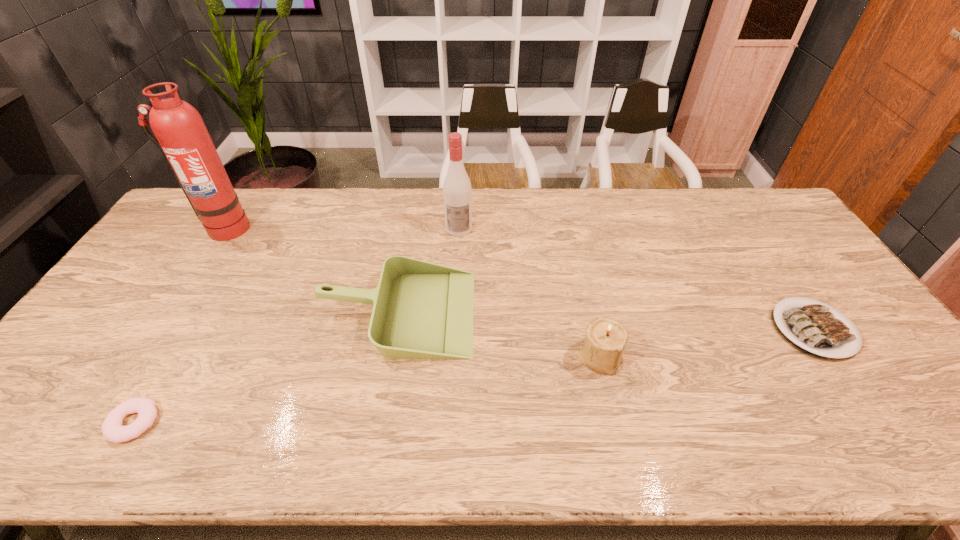
Identify the location of the tallest object. (181, 135).

At what (x,y) coordinates should I click in order to perform the action: click on alcohol. Please return your answer as a coordinate pair (x, y). Looking at the image, I should click on (457, 192).

Where is `candle_holder`? Image resolution: width=960 pixels, height=540 pixels. candle_holder is located at coordinates (605, 340).

Where is `the third tallest object`? The width and height of the screenshot is (960, 540). the third tallest object is located at coordinates (605, 340).

This screenshot has height=540, width=960. I want to click on dustpan, so click(421, 310).

This screenshot has height=540, width=960. Identify the location of the rightmost object. (813, 329).

Identify the location of doughnut. This screenshot has width=960, height=540. (113, 431).

What are the coordinates of `vacant space situated 0.150m on the label side of the fire extinguisher` in the screenshot? It's located at (195, 273).

The height and width of the screenshot is (540, 960). Find the location of `vacant space located 0.370m on the label of the alcohol`. vacant space located 0.370m on the label of the alcohol is located at coordinates (454, 323).

This screenshot has width=960, height=540. I want to click on vacant space situated on the back of the third tallest object, so click(x=586, y=296).